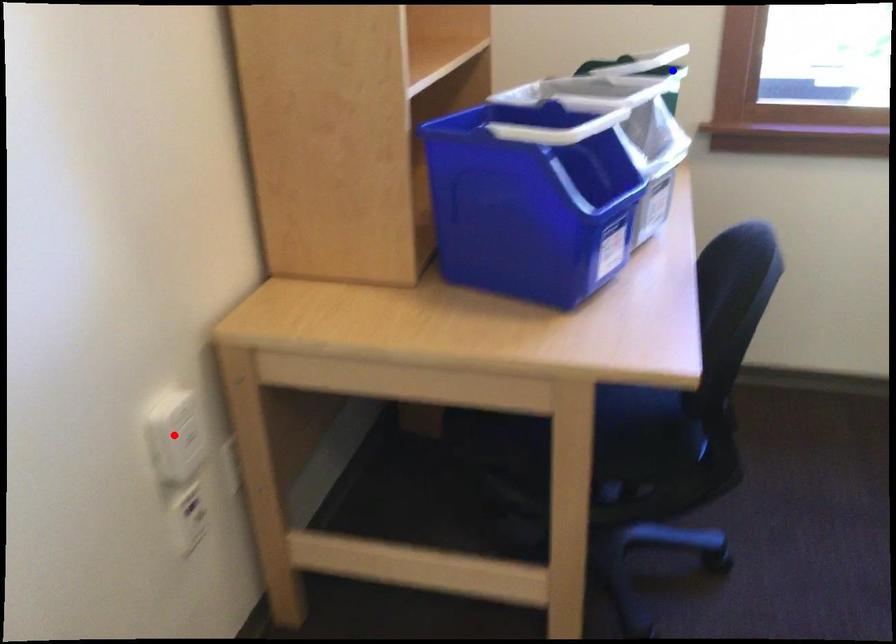
Question: Two points are marked on the image. Which point is closer to the camera?

Choices:
 (A) Blue point is closer.
 (B) Red point is closer.

Answer: (B)